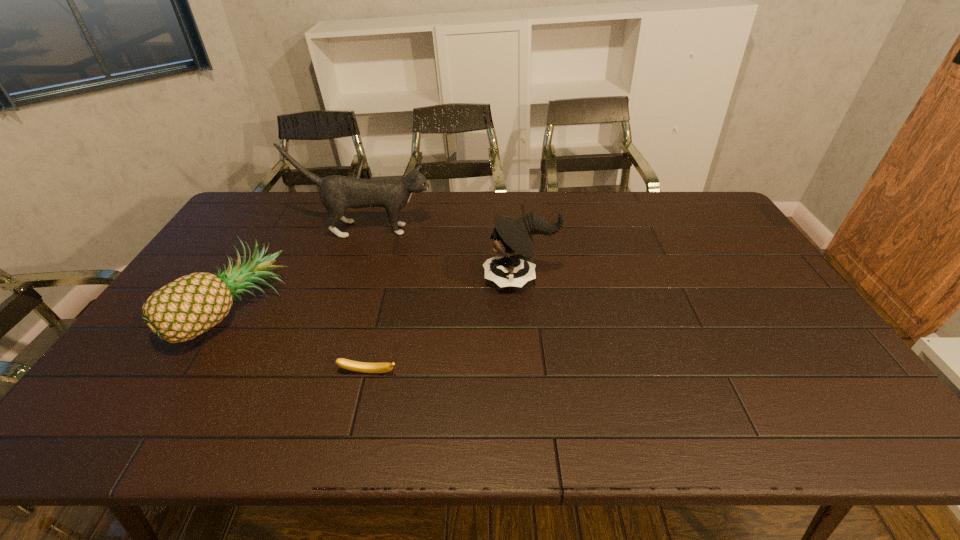
You are a GUI agent. You are given a task and a screenshot of the screen. Output one action in this format:
    pyautogui.click(x=<x>, y=<y>)
    Task: Click on the free location located at the face of the rightmost object
    This screenshot has height=540, width=960.
    Given the screenshot: What is the action you would take?
    pyautogui.click(x=350, y=279)

Find the location of a particular element. The image size is (960, 540). vacant space located 0.080m on the back of the third tallest object is located at coordinates (266, 258).

Find the location of a particular element. The width and height of the screenshot is (960, 540). vacant position located at the stem of the shortest object is located at coordinates (362, 403).

This screenshot has height=540, width=960. I want to click on object that is at the far edge, so click(337, 193).

Find the location of a particular element. The image size is (960, 540). object at the left edge is located at coordinates (189, 306).

You are a GUI agent. You are given a task and a screenshot of the screen. Output one action in this format:
    pyautogui.click(x=<x>, y=<y>)
    Task: Click on the vacant space at the far edge
    The width and height of the screenshot is (960, 540).
    Given the screenshot: What is the action you would take?
    pyautogui.click(x=487, y=222)

Image resolution: width=960 pixels, height=540 pixels. In the image, there is a desktop. Find the location of `vacant space at the near edge`. vacant space at the near edge is located at coordinates (790, 404).

At what (x,y) coordinates should I click in order to perform the action: click on blank space at the right edge of the desktop. Please return your answer as a coordinate pair (x, y). This screenshot has width=960, height=540. Looking at the image, I should click on (773, 306).

I want to click on free region at the far left corner of the desktop, so click(x=283, y=191).

The image size is (960, 540). In order to click on blank region between the rightmost object and the nearest object in this screenshot , I will do `click(444, 326)`.